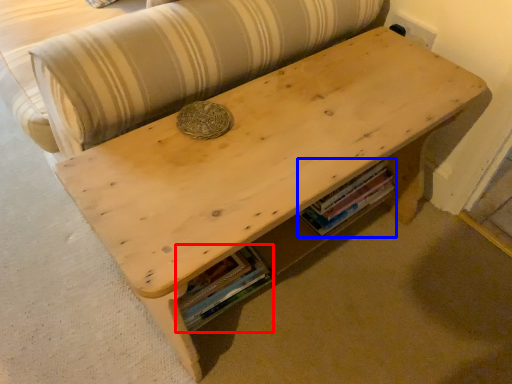
Question: Which point is further to the camera, book (highlighted by a red box) or book (highlighted by a blue box)?

Choices:
 (A) book
 (B) book

Answer: (B)